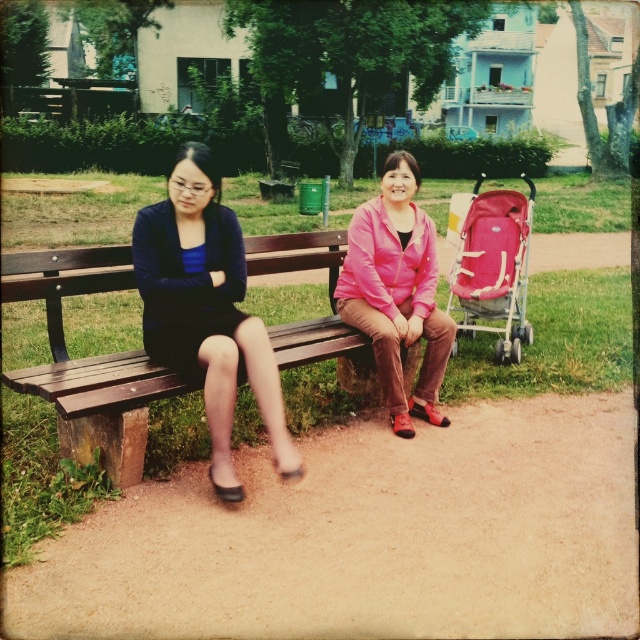
Question: Among these objects, which one is farthest from the camera?

Choices:
 (A) pink matte jacket at center
 (B) matte black dress at left
 (C) matte pink stroller at right

Answer: (C)

Question: Does wooden bench at center have a greater width compared to matte black dress at left?

Choices:
 (A) no
 (B) yes

Answer: (A)

Question: Considering the relative positions of wooden bench at center and matte black dress at left in the image provided, where is wooden bench at center located with respect to matte black dress at left?

Choices:
 (A) above
 (B) below

Answer: (B)

Question: Considering the relative positions of wooden bench at center and matte black dress at left in the image provided, where is wooden bench at center located with respect to matte black dress at left?

Choices:
 (A) right
 (B) left

Answer: (B)

Question: Which point is closer to the camera?

Choices:
 (A) matte black dress at left
 (B) wooden bench at center
 (C) pink matte jacket at center
 (D) matte pink stroller at right

Answer: (B)

Question: Which point is closer to the camera?

Choices:
 (A) (227, 364)
 (B) (404, 346)
 (C) (33, 253)
 (D) (518, 314)

Answer: (A)